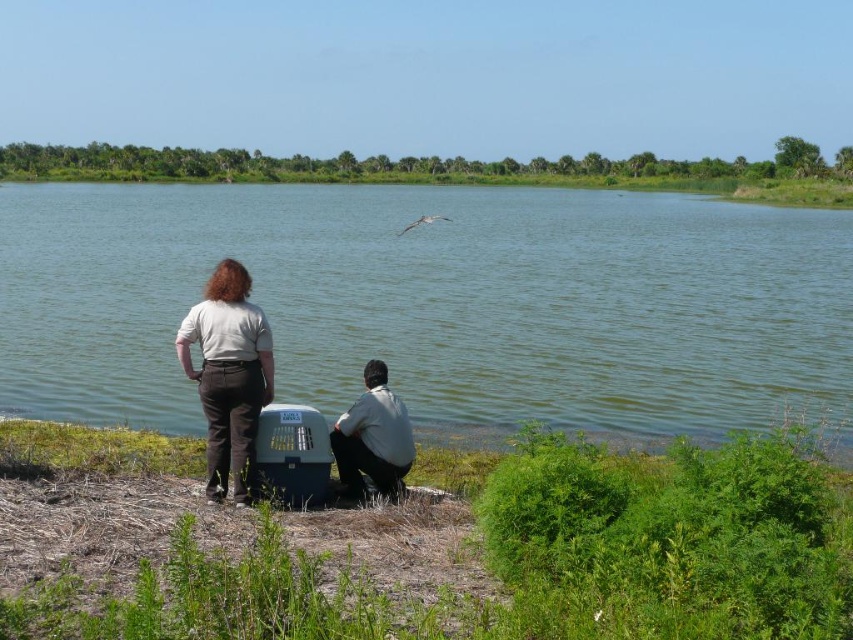
Question: Is green water at center positioned before light gray cotton shirt at center?

Choices:
 (A) yes
 (B) no

Answer: (B)

Question: Which point appears closest to the camera in this image?

Choices:
 (A) (271, 369)
 (B) (334, 433)

Answer: (A)

Question: Is light gray cotton shirt at center thinner than light gray shirt at lower center?

Choices:
 (A) no
 (B) yes

Answer: (A)

Question: Does green water at center come behind light gray shirt at lower center?

Choices:
 (A) no
 (B) yes

Answer: (A)

Question: Which point is closer to the camera?

Choices:
 (A) light gray cotton shirt at center
 (B) light gray shirt at lower center

Answer: (A)

Question: Which of the following is the closest to the observer?

Choices:
 (A) green water at center
 (B) light gray cotton shirt at center
 (C) light gray shirt at lower center

Answer: (B)